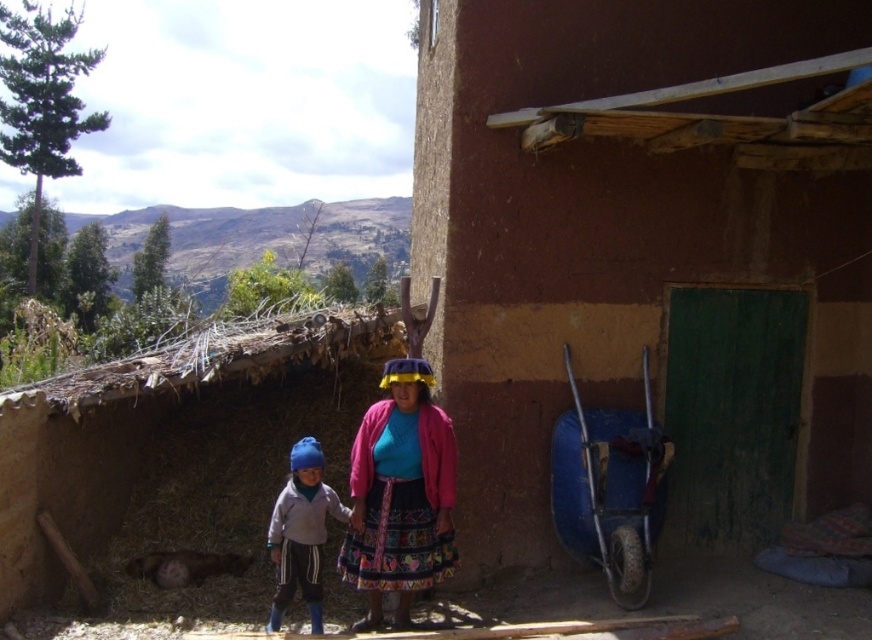
You are an architect designing a new addition to the rustic building. The point at coordinates (400, 493) marks the location of the matte pink sweater. Where should you place the new entrance so it doesn

The new entrance should be placed away from the matte pink sweater at center to avoid disrupting its current position.

You are standing at the center of the image and want to walk towards the brown mud hut at right. Which direction should you face to head directly towards it?

Since the brown mud hut at right is located at point 0.394 on the x axis and 0.743 on the y axis, you should face towards the lower right direction to head directly towards it.

You are a photographer trying to capture a clear shot of the matte pink sweater at center and the matte blue hat at lower left. Which object should you focus on first to ensure both are in focus?

The matte pink sweater at center is in front of the matte blue hat at lower left. To ensure both are in focus, you should focus on the matte blue hat at lower left first since it is closer to the camera, and the sweater behind it will be within the depth of field.